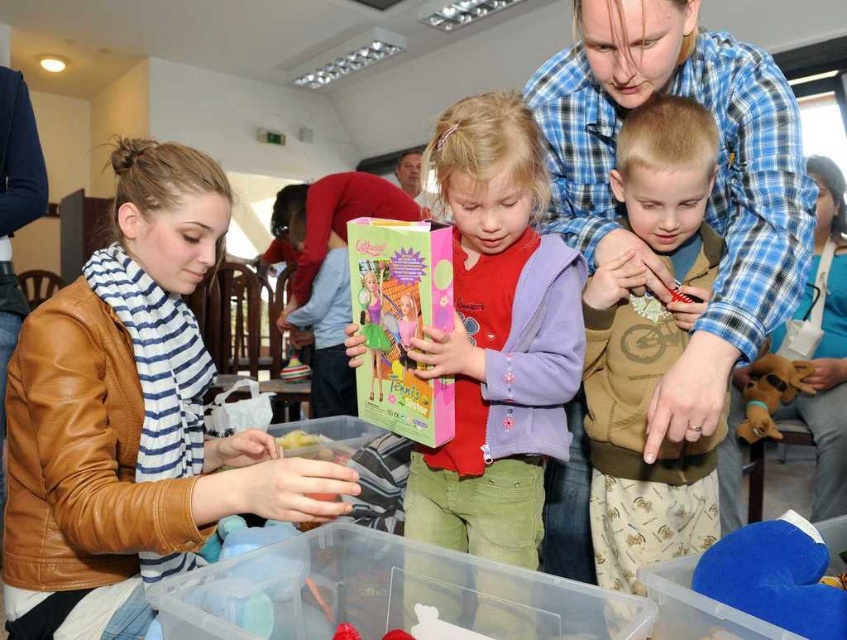
Can you confirm if brown leather jacket at lower left is wider than brown cotton shirt at center?

Correct, the width of brown leather jacket at lower left exceeds that of brown cotton shirt at center.

Who is more forward, (151, 227) or (599, 275)?

Point (151, 227) is in front.

The height and width of the screenshot is (640, 847). I want to click on brown leather jacket at lower left, so click(x=131, y=417).

Can you confirm if brown cotton shirt at center is positioned above pink cardboard book at center?

Incorrect, brown cotton shirt at center is not positioned above pink cardboard book at center.

Is brown cotton shirt at center to the left of pink cardboard book at center from the viewer's perspective?

In fact, brown cotton shirt at center is to the right of pink cardboard book at center.

Who is more distant from viewer, (x=704, y=141) or (x=418, y=324)?

The point (x=704, y=141) is behind.

The width and height of the screenshot is (847, 640). What are the coordinates of `brown cotton shirt at center` in the screenshot? It's located at (638, 436).

The width and height of the screenshot is (847, 640). I want to click on blue fabric purse at upper right, so click(826, 342).

Is blue fabric purse at upper right bigger than blue plush toy at lower right?

Yes.

This screenshot has height=640, width=847. I want to click on blue fabric purse at upper right, so click(826, 342).